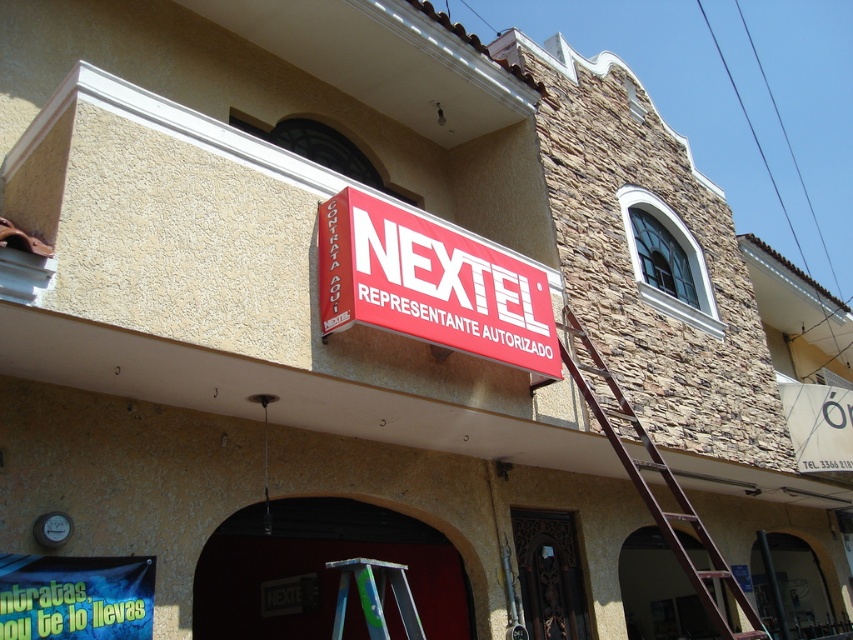
You are a delivery person trying to reach the red plastic sign at center to deliver a package. The brown wooden ladder at right is in your way. Can you move the ladder to access the sign?

The red plastic sign at center is located above the brown wooden ladder at right, so moving the ladder would allow you to access the sign.

You are a painter who needs to reach a high point on the building. You have access to both the brown wooden ladder at right and the silver metallic ladder at center. Which ladder should you choose to reach the highest point?

The brown wooden ladder at right is taller than the silver metallic ladder at center, so you should choose the brown wooden ladder at right to reach the highest point.